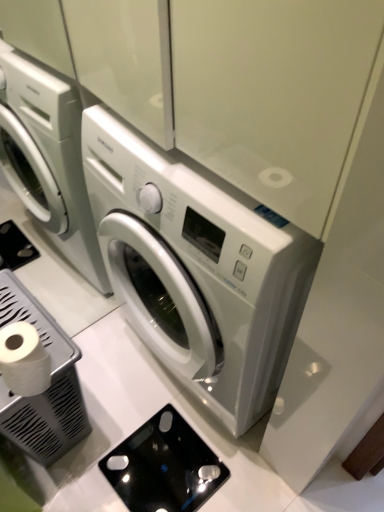
Question: Is white matte toilet paper at lower left wider than white plastic trash can at lower left, which is counted as the first appliance, starting from the left?

Choices:
 (A) yes
 (B) no

Answer: (B)

Question: Are white matte toilet paper at lower left and white plastic trash can at lower left, which ranks as the 2th appliance in right-to-left order, far apart?

Choices:
 (A) no
 (B) yes

Answer: (A)

Question: Is white matte toilet paper at lower left in front of white plastic trash can at lower left, which is counted as the first appliance, starting from the left?

Choices:
 (A) no
 (B) yes

Answer: (B)

Question: Is the position of white matte toilet paper at lower left more distant than that of white plastic trash can at lower left, which ranks as the 2th appliance in right-to-left order?

Choices:
 (A) no
 (B) yes

Answer: (A)

Question: Is white matte toilet paper at lower left placed right next to white plastic trash can at lower left, which ranks as the 2th appliance in right-to-left order?

Choices:
 (A) no
 (B) yes

Answer: (A)

Question: Visually, is white glossy washing machine at center positioned to the left or to the right of white matte toilet paper at lower left?

Choices:
 (A) left
 (B) right

Answer: (B)

Question: Is point (299, 238) closer or farther from the camera than point (36, 373)?

Choices:
 (A) closer
 (B) farther

Answer: (A)

Question: Would you say white glossy washing machine at center is inside or outside white matte toilet paper at lower left?

Choices:
 (A) outside
 (B) inside

Answer: (A)

Question: Relative to white matte toilet paper at lower left, is white glossy washing machine at center in front or behind?

Choices:
 (A) behind
 (B) front

Answer: (B)

Question: Is black glass scale at lower center, which is the first appliance in right-to-left order, wider or thinner than white matte toilet paper at lower left?

Choices:
 (A) thin
 (B) wide

Answer: (B)

Question: Is black glass scale at lower center, which is the first appliance in right-to-left order, taller or shorter than white matte toilet paper at lower left?

Choices:
 (A) short
 (B) tall

Answer: (A)

Question: From the image's perspective, relative to white matte toilet paper at lower left, is black glass scale at lower center, which is the first appliance in right-to-left order, above or below?

Choices:
 (A) above
 (B) below

Answer: (B)

Question: Based on their sizes in the image, would you say black glass scale at lower center, acting as the 2th appliance starting from the left, is bigger or smaller than white matte toilet paper at lower left?

Choices:
 (A) small
 (B) big

Answer: (A)

Question: In the image, is white glossy washing machine at center positioned in front of or behind black glass scale at lower center, which is the first appliance in right-to-left order?

Choices:
 (A) behind
 (B) front

Answer: (B)

Question: Would you say white glossy washing machine at center is to the left or to the right of black glass scale at lower center, acting as the 2th appliance starting from the left, in the picture?

Choices:
 (A) left
 (B) right

Answer: (B)